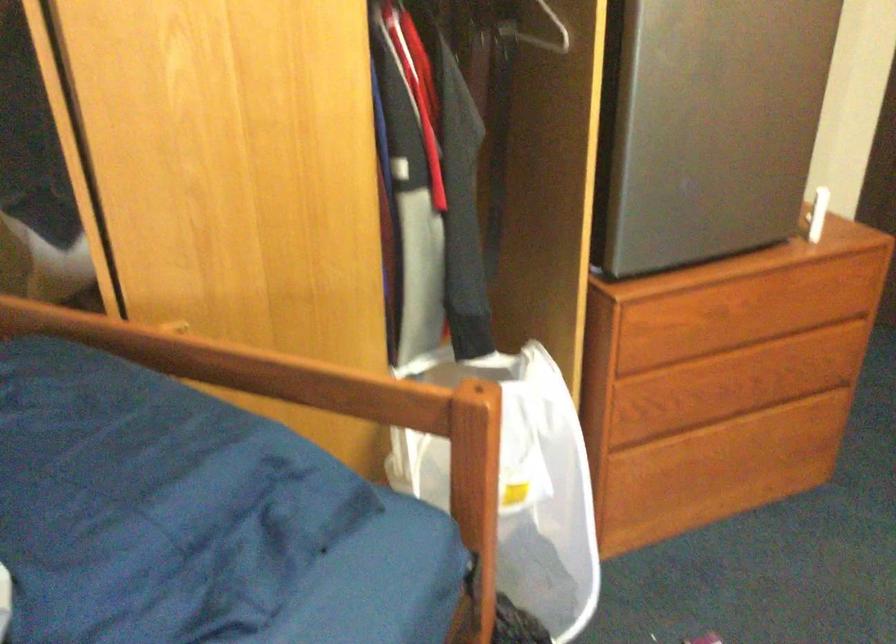
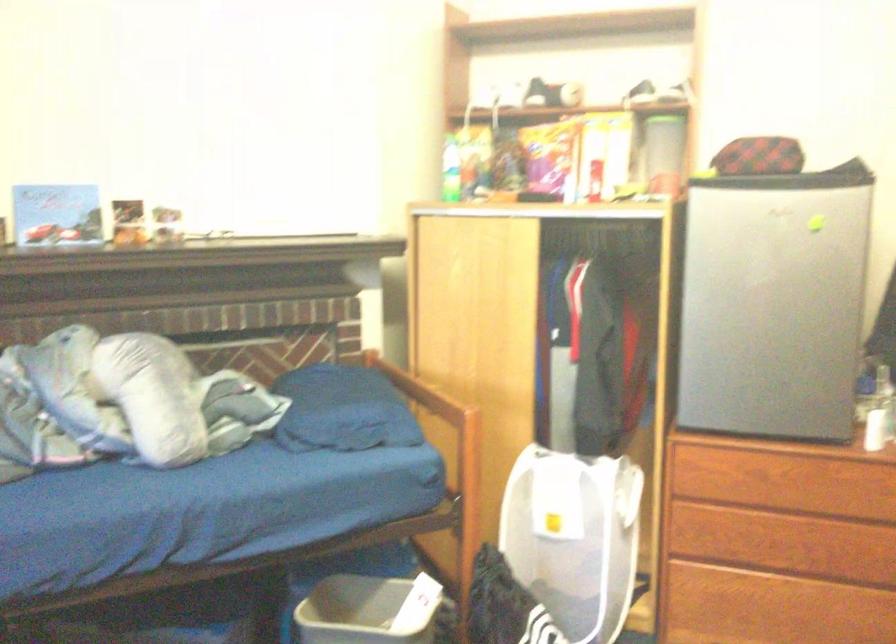
Locate, in the second image, the point that corresponds to [522,491] in the first image.

(574, 538)